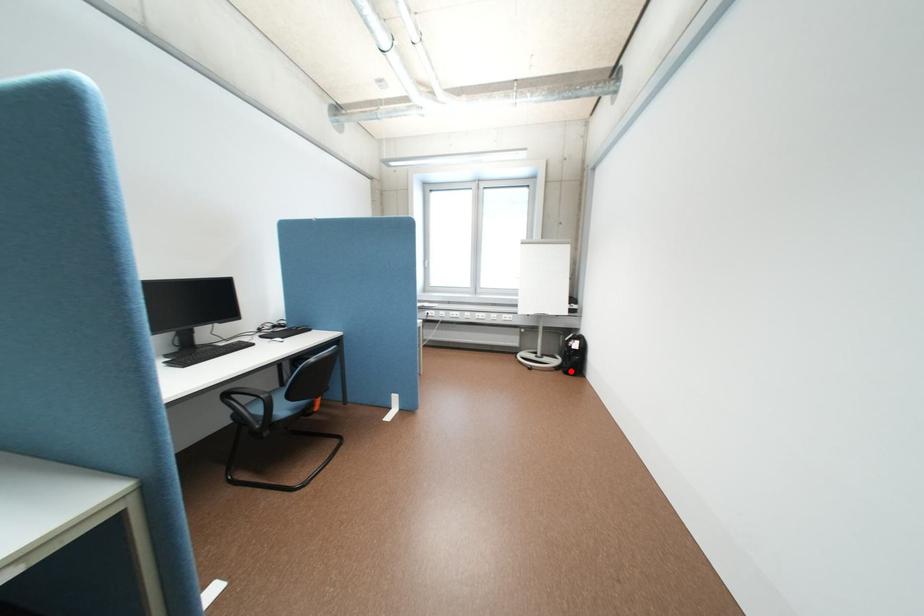
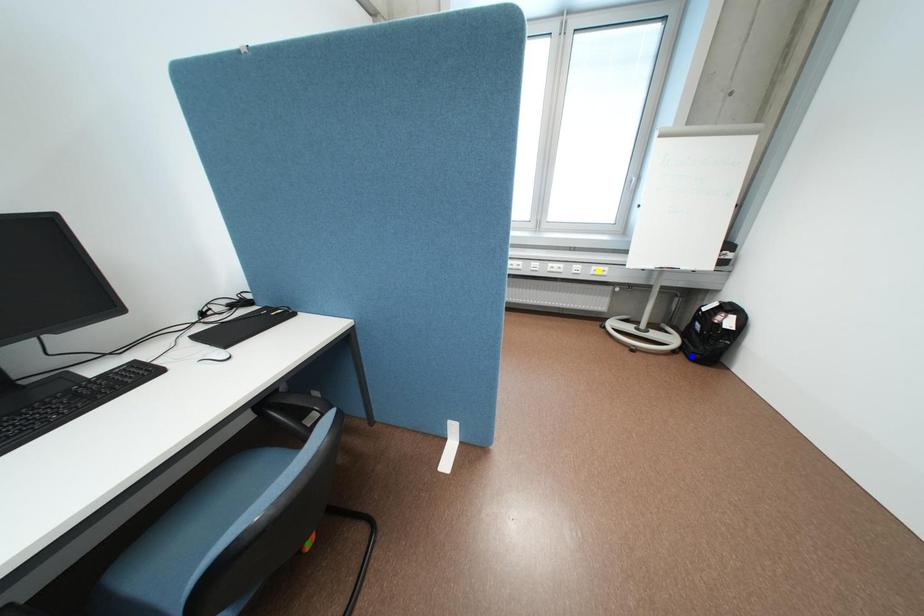
Question: I am providing you with two images of the same scene from different viewpoints. A red point is marked on the first image. You are given multiple points on the second image. Can you choose the point in image 2 that corresponds to the point in image 1?

Choices:
 (A) blue point
 (B) yellow point
 (C) green point

Answer: (A)